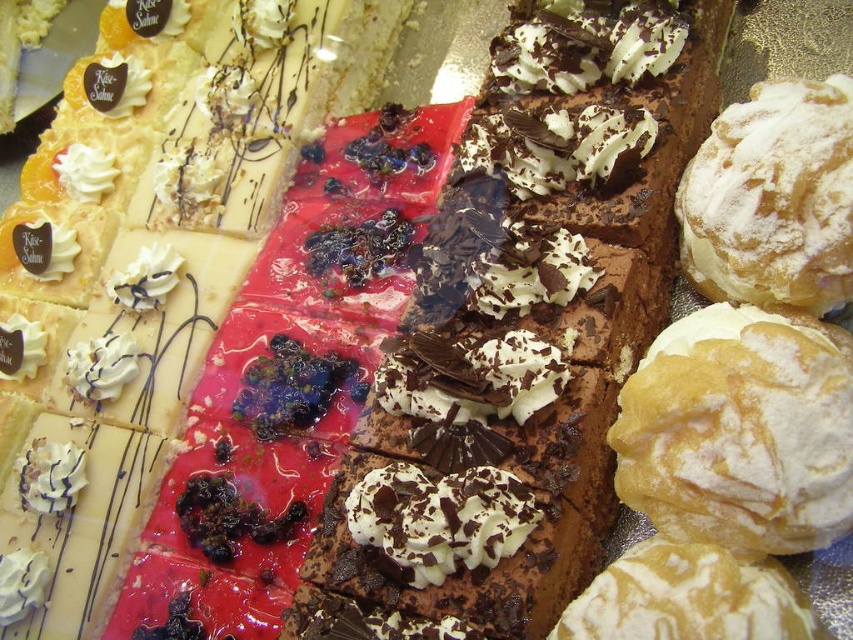
You are a customer at the bakery and want to choose between the powdered sugar puff at upper right and the powdered white cream puff at center right. Based on their sizes, which one would you pick if you prefer a bigger portion?

The powdered sugar puff at upper right has a larger size compared to the powdered white cream puff at center right, so you should choose the powdered sugar puff at upper right for a bigger portion.

What is located at the coordinates point (773, 198) in the bakery display?

The coordinates point (773, 198) indicate the location of the powdered sugar puff at upper right.